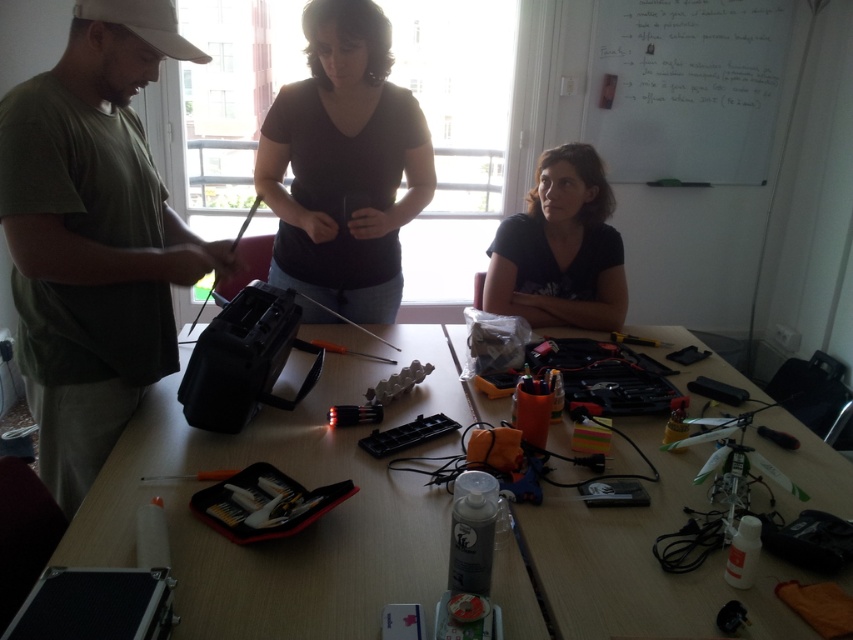
You are standing in the room where the workshop is taking place. You need to place a new tool on the wooden table at center. Where exactly should you place it?

The wooden table at center is located at the 2D coordinates point (276, 540), so you should place the new tool there.